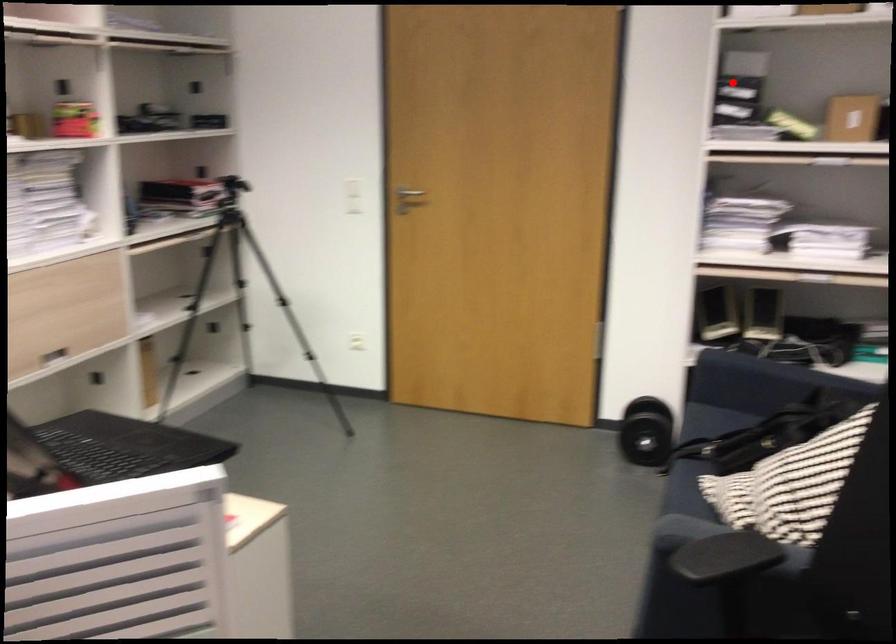
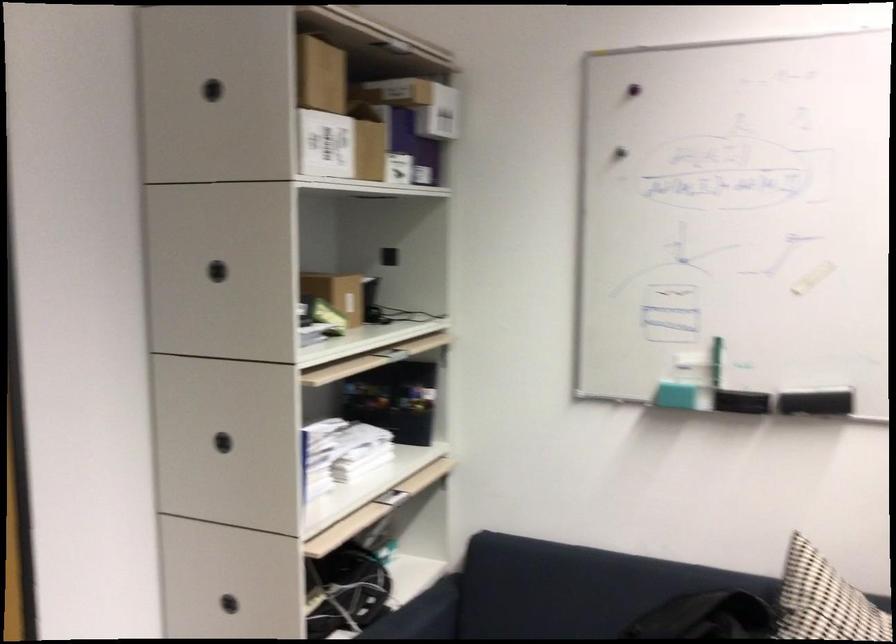
The point at the highlighted location is marked in the first image. Where is the corresponding point in the second image?

(217, 270)